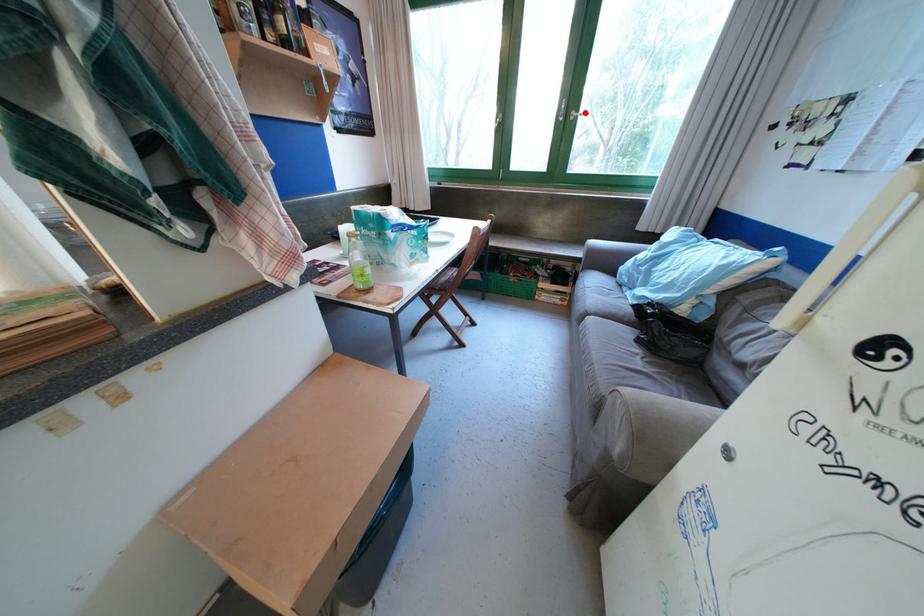
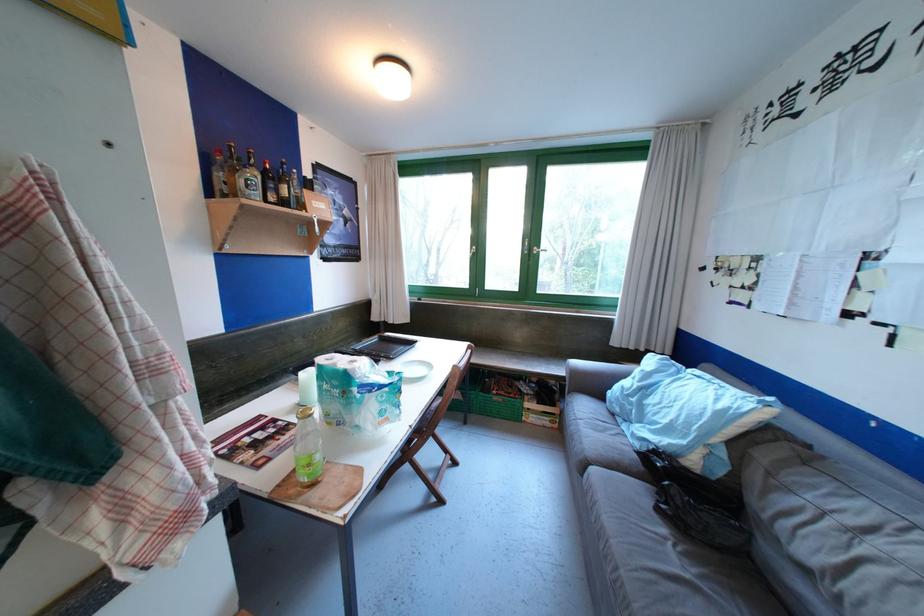
Where in the second image is the point corresponding to the highlighted location from the first image?

(545, 249)